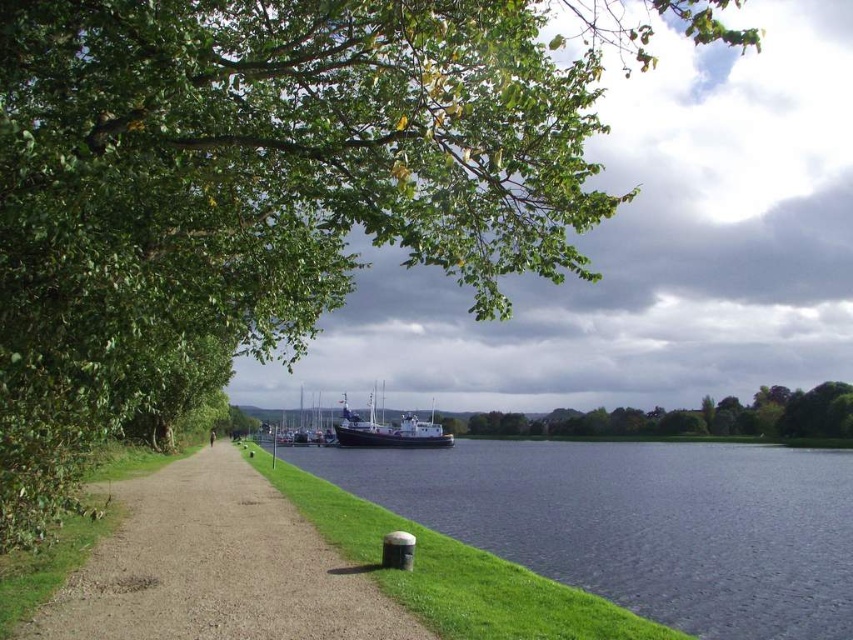
Question: Is green leafy tree at center behind white wooden boat at center?

Choices:
 (A) yes
 (B) no

Answer: (A)

Question: Which is farther from the dark blue water at lower center?

Choices:
 (A) dirt/gravel path at lower left
 (B) white wooden boat at center
 (C) metallic blue boat at center

Answer: (A)

Question: Observing the image, what is the correct spatial positioning of dirt/gravel path at lower left in reference to green leafy tree at center?

Choices:
 (A) left
 (B) right

Answer: (A)

Question: Which point is closer to the camera?

Choices:
 (A) (845, 394)
 (B) (766, 563)
 (C) (279, 436)

Answer: (B)

Question: Does dark blue water at lower center appear over white wooden boat at center?

Choices:
 (A) no
 (B) yes

Answer: (A)

Question: Among these points, which one is nearest to the camera?

Choices:
 (A) (762, 637)
 (B) (273, 435)
 (C) (825, 381)

Answer: (A)